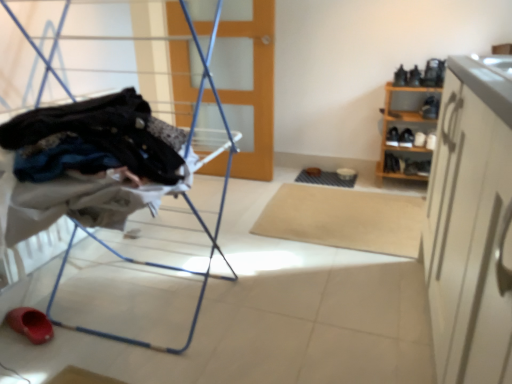
The image size is (512, 384). What are the coordinates of `free space that is in between rubber/soft sole shoe at lower left and beige carpet at center` in the screenshot? It's located at point(225,257).